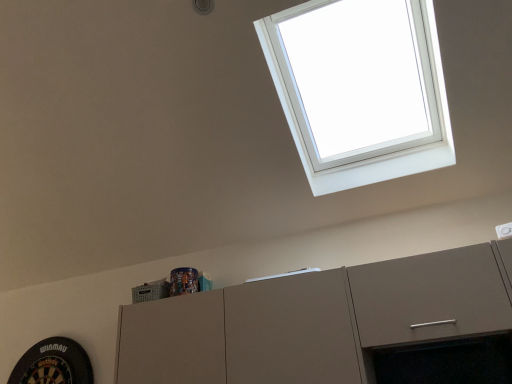
Question: Should I look upward or downward to see white plastic window at upper right?

Choices:
 (A) down
 (B) up

Answer: (B)

Question: Can you confirm if matte gray cabinet at upper center is taller than white plastic window at upper right?

Choices:
 (A) no
 (B) yes

Answer: (A)

Question: From the image's perspective, is matte gray cabinet at upper center on white plastic window at upper right?

Choices:
 (A) yes
 (B) no

Answer: (B)

Question: From a real-world perspective, is matte gray cabinet at upper center positioned over white plastic window at upper right based on gravity?

Choices:
 (A) yes
 (B) no

Answer: (B)

Question: Can you confirm if matte gray cabinet at upper center is smaller than white plastic window at upper right?

Choices:
 (A) no
 (B) yes

Answer: (B)

Question: Can you confirm if matte gray cabinet at upper center is shorter than white plastic window at upper right?

Choices:
 (A) yes
 (B) no

Answer: (A)

Question: Is matte gray cabinet at upper center next to white plastic window at upper right?

Choices:
 (A) yes
 (B) no

Answer: (B)

Question: Considering the relative positions of white plastic window at upper right and matte gray cabinet at upper center in the image provided, is white plastic window at upper right to the left of matte gray cabinet at upper center from the viewer's perspective?

Choices:
 (A) no
 (B) yes

Answer: (A)

Question: Is white plastic window at upper right positioned behind matte gray cabinet at upper center?

Choices:
 (A) yes
 (B) no

Answer: (B)

Question: Is white plastic window at upper right looking in the opposite direction of matte gray cabinet at upper center?

Choices:
 (A) no
 (B) yes

Answer: (A)

Question: Are white plastic window at upper right and matte gray cabinet at upper center far apart?

Choices:
 (A) yes
 (B) no

Answer: (A)

Question: From a real-world perspective, is white plastic window at upper right located beneath matte gray cabinet at upper center?

Choices:
 (A) yes
 (B) no

Answer: (B)

Question: Considering the relative sizes of white plastic window at upper right and matte gray cabinet at upper center in the image provided, is white plastic window at upper right wider than matte gray cabinet at upper center?

Choices:
 (A) no
 (B) yes

Answer: (B)

Question: From the image's perspective, is white plastic window at upper right positioned above or below matte gray cabinet at upper center?

Choices:
 (A) above
 (B) below

Answer: (A)